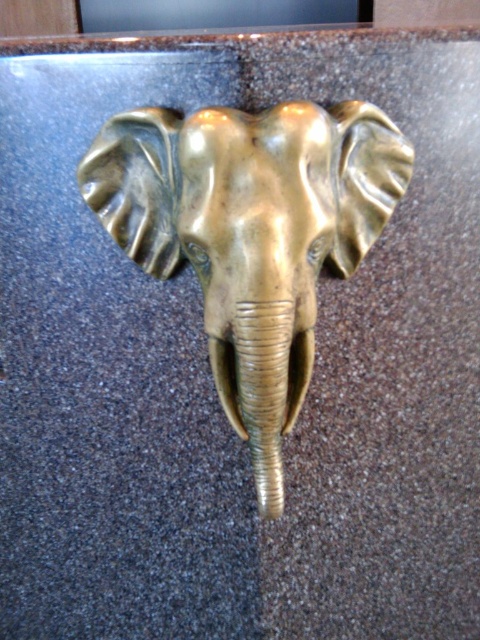
Which of these two, gold polished elephant head at center or gold textured tusk at center, stands shorter?

gold textured tusk at center is shorter.

Can you confirm if gold polished elephant head at center is positioned to the left of gold textured tusk at center?

Correct, you'll find gold polished elephant head at center to the left of gold textured tusk at center.

Measure the distance between gold polished elephant head at center and camera.

gold polished elephant head at center is 30.46 inches from camera.

You are a GUI agent. You are given a task and a screenshot of the screen. Output one action in this format:
    pyautogui.click(x=<x>, y=<y>)
    Task: Click on the gold polished elephant head at center
    The width and height of the screenshot is (480, 640).
    Given the screenshot: What is the action you would take?
    pyautogui.click(x=251, y=234)